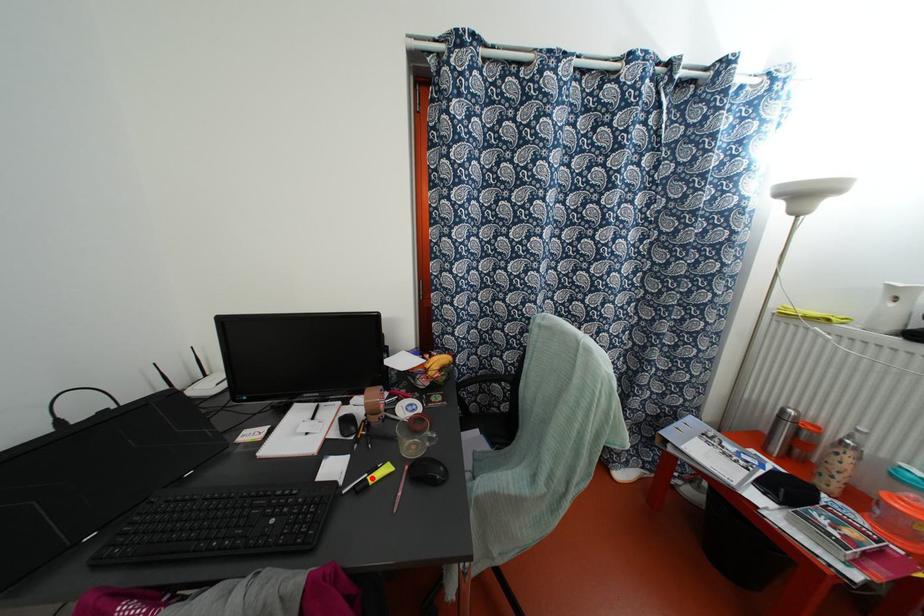
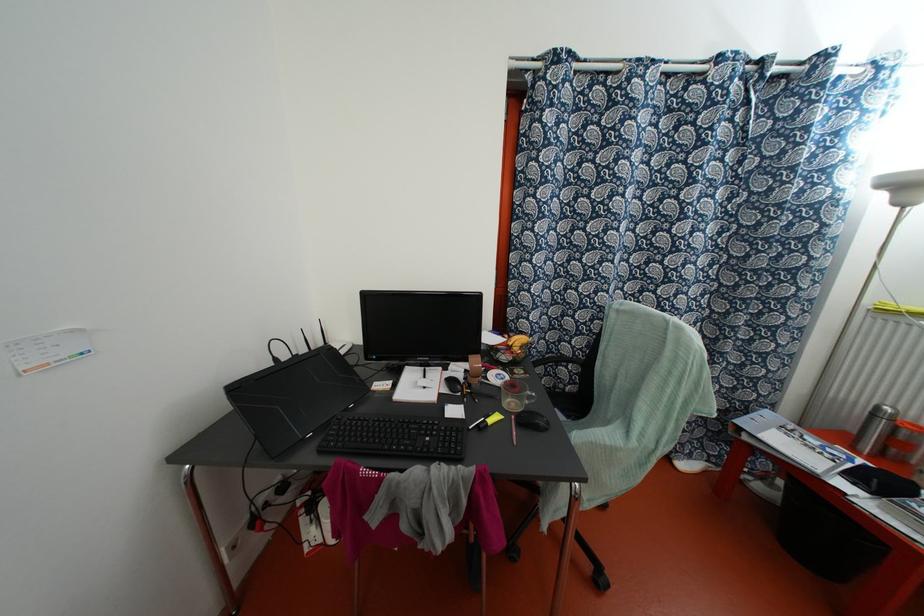
Locate, in the second image, the point that corresponds to the highlighted location in the first image.

(489, 421)